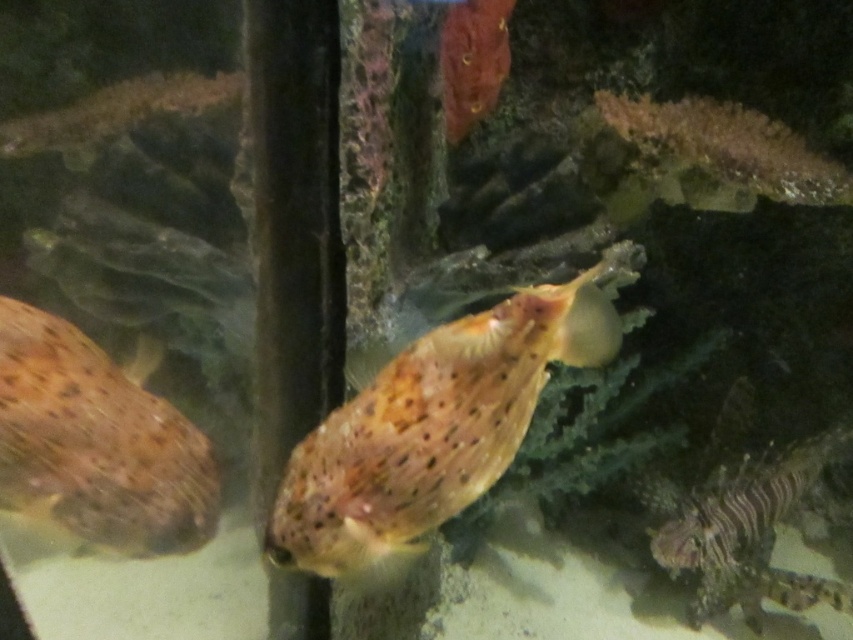
Is spotted orange fish at center above speckled skin at left?

Yes.

Is spotted orange fish at center smaller than speckled skin at left?

Yes.

Locate an element on the screen. The width and height of the screenshot is (853, 640). spotted orange fish at center is located at coordinates (434, 424).

At what (x,y) coordinates should I click in order to perform the action: click on spotted orange fish at center. Please return your answer as a coordinate pair (x, y). The height and width of the screenshot is (640, 853). Looking at the image, I should click on (434, 424).